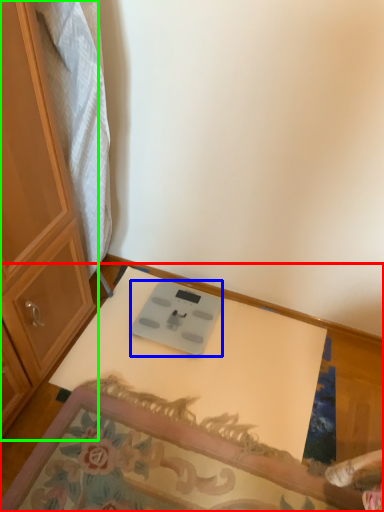
Question: Which object is positioned farthest from table (highlighted by a red box)? Select from weight scale (highlighted by a blue box) and cabinetry (highlighted by a green box).

Choices:
 (A) weight scale
 (B) cabinetry

Answer: (B)